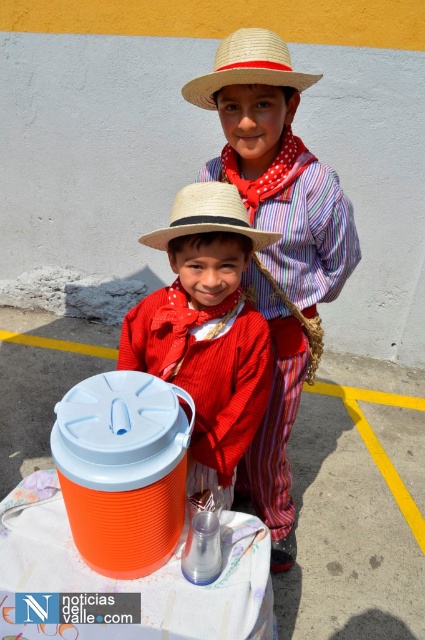
Which is in front, point (217, 209) or point (280, 61)?

Point (217, 209) is in front.

Is matte straw hat at center positioned before strawhat at upper center?

Yes.

Is point (201, 301) positioned in front of point (252, 83)?

That is True.

Find the location of a particular element. matte straw hat at center is located at coordinates (206, 326).

The image size is (425, 640). Identify the location of matte plastic bucket at center. (277, 244).

Image resolution: width=425 pixels, height=640 pixels. What are the coordinates of `matte plastic bucket at center` in the screenshot? It's located at (277, 244).

Looking at this image, is strawhat at upper center above strawhat at center?

Correct, strawhat at upper center is located above strawhat at center.

Does point (209, 83) come farther from viewer compared to point (189, 220)?

Yes, point (209, 83) is farther from viewer.

Locate an element on the screen. The width and height of the screenshot is (425, 640). strawhat at upper center is located at coordinates [x=246, y=67].